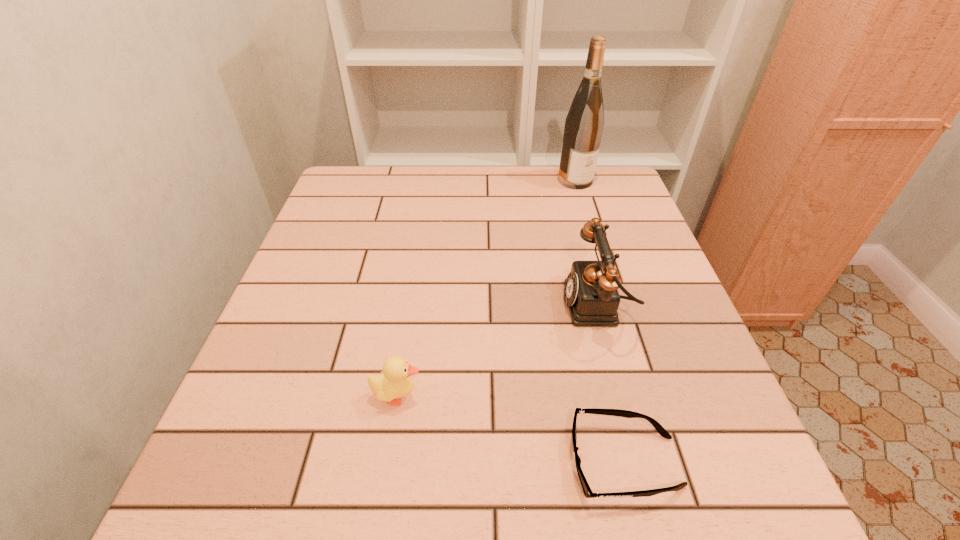
Find the location of `object that stands as the closest to the nearest object`. object that stands as the closest to the nearest object is located at coordinates (592, 296).

Where is `free space in the image that satisfies the following two spatial constraints: 1. on the front side of the farthest object; 2. on the front-facing side of the duckling`? Image resolution: width=960 pixels, height=540 pixels. free space in the image that satisfies the following two spatial constraints: 1. on the front side of the farthest object; 2. on the front-facing side of the duckling is located at coordinates (640, 395).